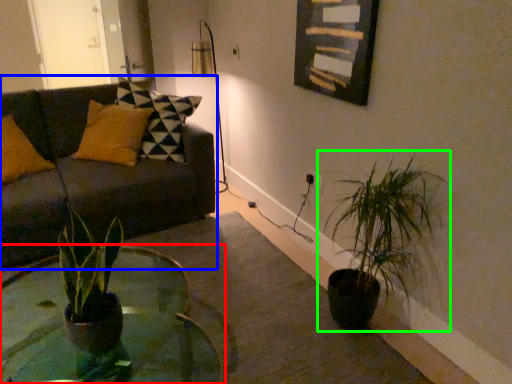
Question: Estimate the real-world distances between objects in this image. Which object is farther from coffee table (highlighted by a red box), studio couch (highlighted by a blue box) or houseplant (highlighted by a green box)?

Choices:
 (A) studio couch
 (B) houseplant

Answer: (B)